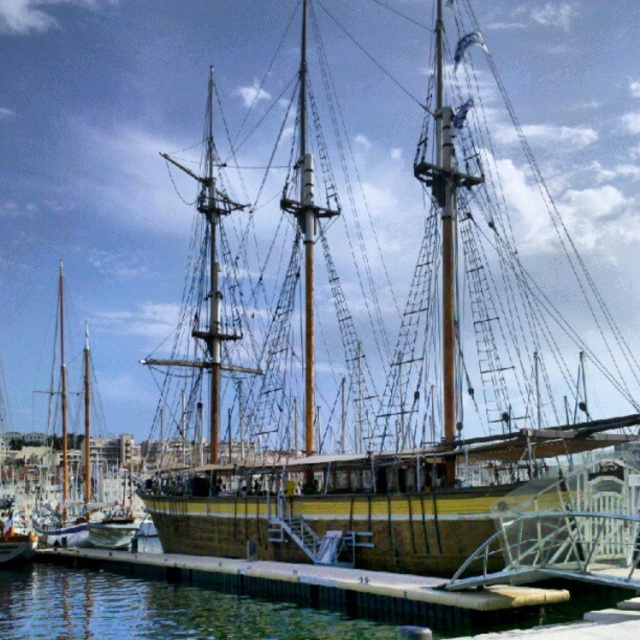
Does wooden ship at center appear on the left side of wooden mast at center?

No, wooden ship at center is not to the left of wooden mast at center.

Is wooden ship at center closer to camera compared to wooden mast at center?

Yes, it is.

Is point (250, 538) closer to camera compared to point (58, 356)?

That is True.

Locate an element on the screen. This screenshot has height=640, width=640. wooden ship at center is located at coordinates 428,372.